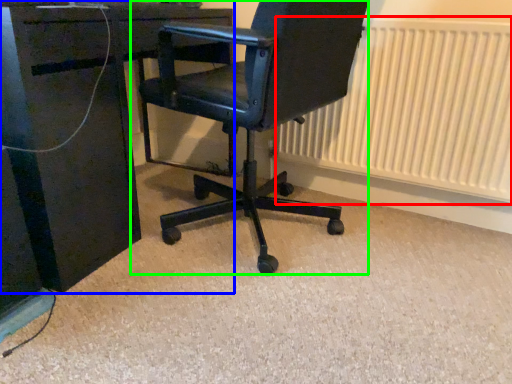
Question: Which object is the closest to the radiator (highlighted by a red box)? Choose among these: desk (highlighted by a blue box) or chair (highlighted by a green box).

Choices:
 (A) desk
 (B) chair

Answer: (B)